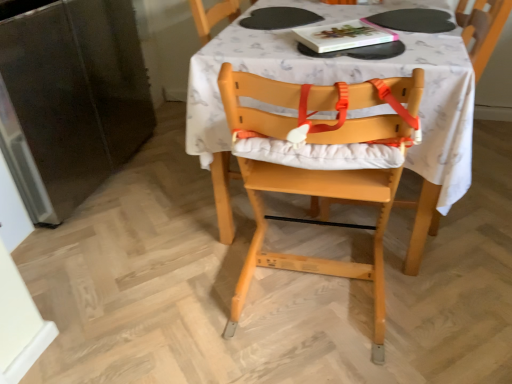
At what (x,y) coordinates should I click in order to perform the action: click on natural wood highchair at center. Please return your answer as a coordinate pair (x, y). Looking at the image, I should click on (323, 108).

You are a GUI agent. You are given a task and a screenshot of the screen. Output one action in this format:
    pyautogui.click(x=<x>, y=<y>)
    Task: Click on the hardcover book at upper center
    
    Given the screenshot: What is the action you would take?
    pyautogui.click(x=343, y=36)

Is point (224, 192) closer or farther from the camera than point (364, 34)?

Point (224, 192) is farther from the camera than point (364, 34).

Is white fabric table at center not near hardcover book at upper center?

No, white fabric table at center is in close proximity to hardcover book at upper center.

From a real-world perspective, does white fabric table at center sit lower than hardcover book at upper center?

Correct, in the physical world, white fabric table at center is lower than hardcover book at upper center.

Is hardcover book at upper center at the back of white fabric table at center?

white fabric table at center is not turned away from hardcover book at upper center.

In the scene shown: From a real-world perspective, which is physically below, natural wood highchair at center or white fabric table at center?

white fabric table at center.

Consider the image. Can you confirm if natural wood highchair at center is wider than white fabric table at center?

Incorrect, the width of natural wood highchair at center does not surpass that of white fabric table at center.

In the scene shown: Considering the relative sizes of natural wood highchair at center and white fabric table at center in the image provided, is natural wood highchair at center taller than white fabric table at center?

Correct, natural wood highchair at center is much taller as white fabric table at center.

Who is more distant, natural wood highchair at center or white fabric table at center?

white fabric table at center.

Can you confirm if hardcover book at upper center is thinner than natural wood highchair at center?

Yes, hardcover book at upper center is thinner than natural wood highchair at center.

From the image's perspective, which one is positioned lower, hardcover book at upper center or natural wood highchair at center?

From the image's view, natural wood highchair at center is below.

Who is taller, hardcover book at upper center or natural wood highchair at center?

With more height is natural wood highchair at center.

Looking at this image, can you tell me how much hardcover book at upper center and natural wood highchair at center differ in facing direction?

There is a 146-degree angle between the facing directions of hardcover book at upper center and natural wood highchair at center.

Is white fabric table at center far from natural wood highchair at center?

Actually, white fabric table at center and natural wood highchair at center are a little close together.

Is point (239, 43) closer or farther from the camera than point (326, 105)?

Clearly, point (239, 43) is more distant from the camera than point (326, 105).

Is white fabric table at center facing towards natural wood highchair at center?

Yes, white fabric table at center is facing natural wood highchair at center.

How distant is white fabric table at center from natural wood highchair at center?

7.72 inches.

Would you say white fabric table at center is part of hardcover book at upper center's contents?

No.

How many degrees apart are the facing directions of hardcover book at upper center and white fabric table at center?

The angular difference between hardcover book at upper center and white fabric table at center is 34.1 degrees.

Considering the relative sizes of hardcover book at upper center and white fabric table at center in the image provided, is hardcover book at upper center taller than white fabric table at center?

No, hardcover book at upper center is not taller than white fabric table at center.

Which is closer, (323, 33) or (445, 98)?

The point (445, 98) is closer.

Is natural wood highchair at center wider or thinner than hardcover book at upper center?

In the image, natural wood highchair at center appears to be wider than hardcover book at upper center.

Does natural wood highchair at center have a smaller size compared to hardcover book at upper center?

No.

Is natural wood highchair at center completely or partially outside of hardcover book at upper center?

Indeed, natural wood highchair at center is completely outside hardcover book at upper center.

Is natural wood highchair at center far away from hardcover book at upper center?

No, natural wood highchair at center is not far from hardcover book at upper center.

At what (x,y) coordinates should I click in order to perform the action: click on book that appears behind the white fabric table at center. Please return your answer as a coordinate pair (x, y). Image resolution: width=512 pixels, height=384 pixels. Looking at the image, I should click on (343, 36).

Where is `table lying on the right of natural wood highchair at center`? The image size is (512, 384). table lying on the right of natural wood highchair at center is located at coordinates (349, 81).

When comparing their distances from natural wood highchair at center, does hardcover book at upper center or white fabric table at center seem closer?

Based on the image, white fabric table at center appears to be nearer to natural wood highchair at center.

From the image, which object appears to be nearer to hardcover book at upper center, white fabric table at center or natural wood highchair at center?

white fabric table at center is positioned closer to the anchor hardcover book at upper center.

When comparing their distances from white fabric table at center, does natural wood highchair at center or hardcover book at upper center seem closer?

Among the two, natural wood highchair at center is located nearer to white fabric table at center.

Looking at this image, estimate the real-world distances between objects in this image. Which object is further from natural wood highchair at center, white fabric table at center or hardcover book at upper center?

hardcover book at upper center.

Looking at the image, which one is located further to hardcover book at upper center, natural wood highchair at center or white fabric table at center?

natural wood highchair at center.

Based on their spatial positions, is hardcover book at upper center or natural wood highchair at center further from white fabric table at center?

Among the two, hardcover book at upper center is located further to white fabric table at center.

Locate an element on the screen. table between hardcover book at upper center and natural wood highchair at center in the vertical direction is located at coordinates (349, 81).